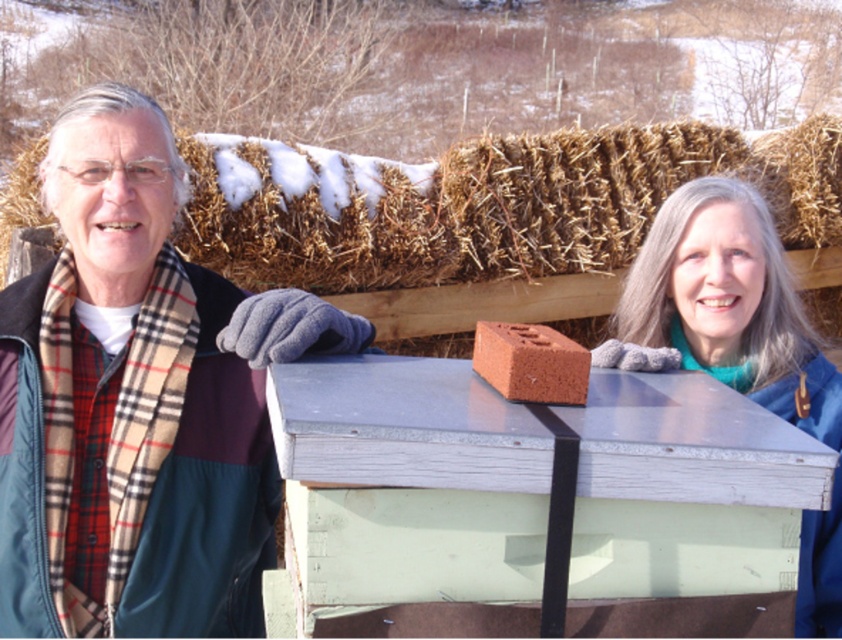
Which of these two, plaid scarf at left or red clay brick at center, stands shorter?

Standing shorter between the two is red clay brick at center.

Image resolution: width=842 pixels, height=640 pixels. What are the coordinates of `plaid scarf at left` in the screenshot? It's located at (137, 401).

Between smooth gray wood crate at center and brown straw bale at upper center, which one has less height?

With less height is smooth gray wood crate at center.

Is smooth gray wood crate at center above brown straw bale at upper center?

No.

Between point (370, 522) and point (489, 268), which one is positioned behind?

The point (489, 268) is behind.

The image size is (842, 640). I want to click on smooth gray wood crate at center, so click(x=409, y=481).

Can you confirm if plaid scarf at left is shorter than brown straw bale at upper center?

No.

Who is more distant from viewer, [36,456] or [494,182]?

The point [494,182] is behind.

Does point (158, 611) lie in front of point (737, 160)?

Yes, it is.

In order to click on plaid scarf at left in this screenshot , I will do [137, 401].